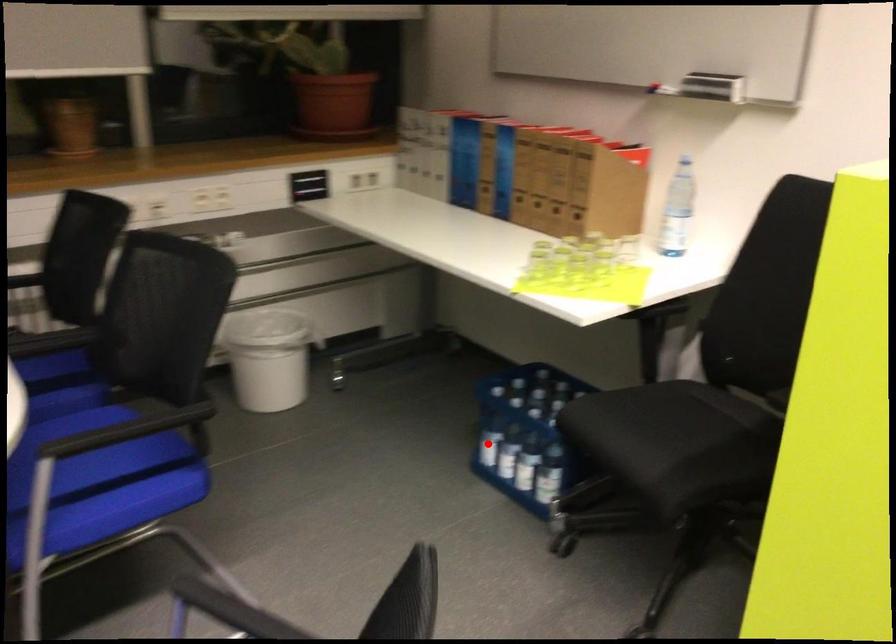
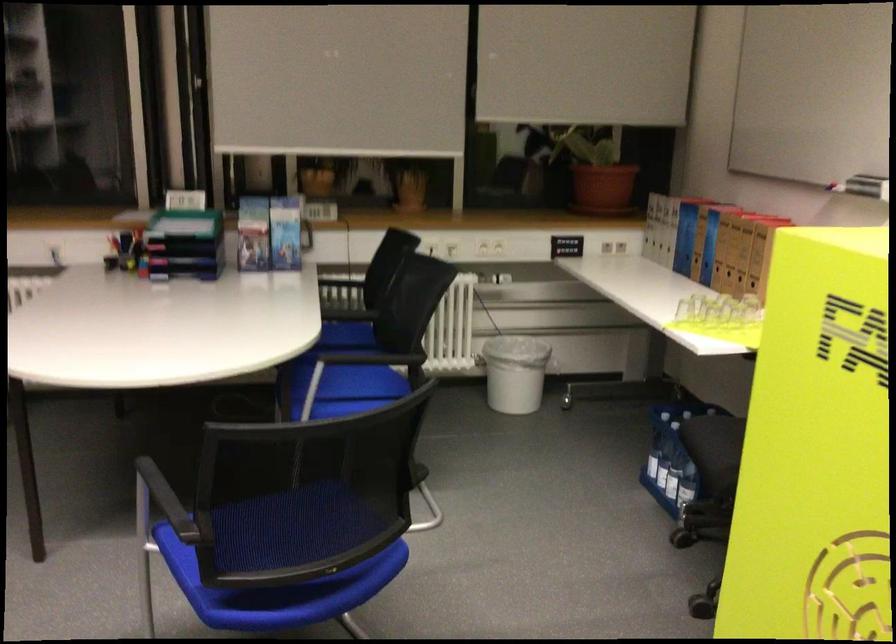
Question: A red point is marked in image1. In image2, is the corresponding 3D point closer to the camera or farther? Reply with the corresponding letter.

Choices:
 (A) The corresponding 3D point is closer.
 (B) The corresponding 3D point is farther.

Answer: (B)